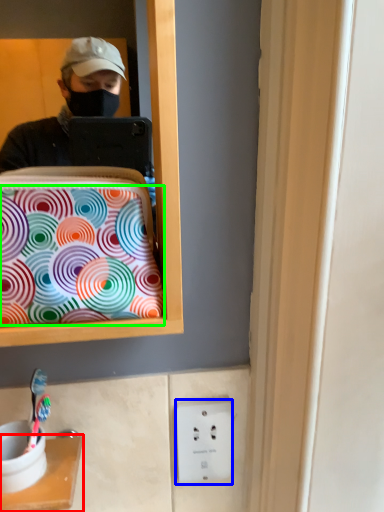
Question: Considering the real-world distances, which object is farthest from furniture (highlighted by a red box)? electric outlet (highlighted by a blue box) or pattern (highlighted by a green box)?

Choices:
 (A) electric outlet
 (B) pattern

Answer: (B)